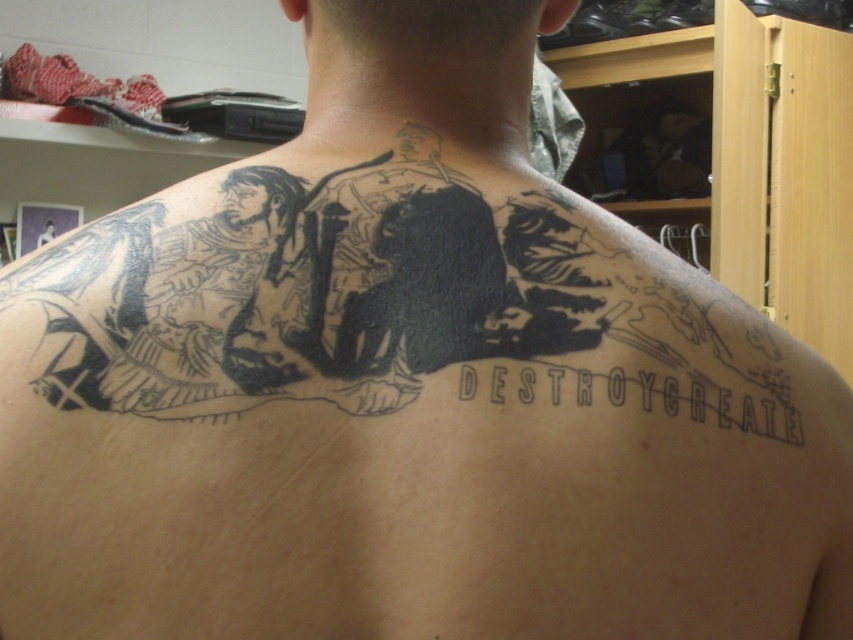
You are a GUI agent. You are given a task and a screenshot of the screen. Output one action in this format:
    pyautogui.click(x=<x>, y=<y>)
    Task: Click on the black ink tattoo at upper center
    The width and height of the screenshot is (853, 640).
    Given the screenshot: What is the action you would take?
    pyautogui.click(x=373, y=301)

Who is more forward, (120, 396) or (726, 396)?

Positioned in front is point (120, 396).

I want to click on black ink tattoo at upper center, so click(373, 301).